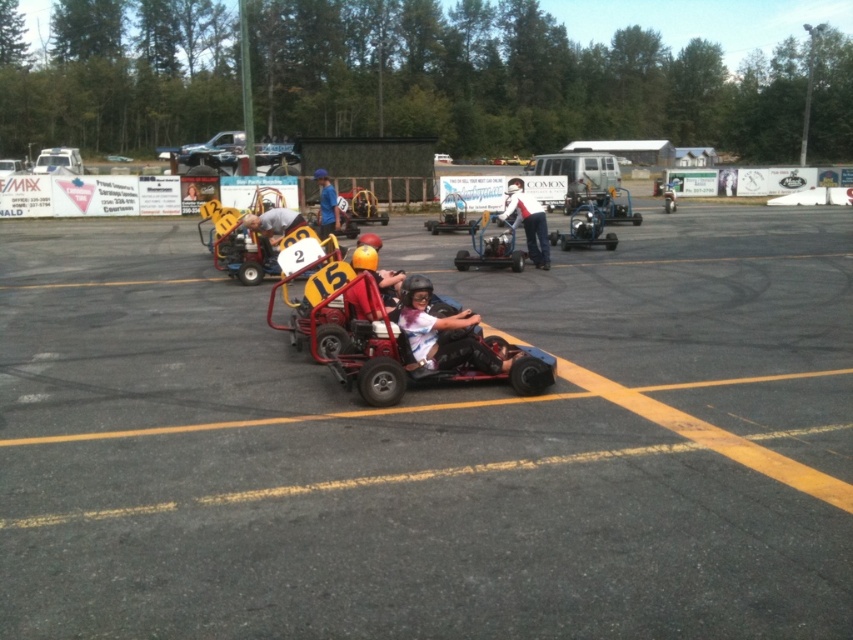
You are a race official at the go kart track. You need to determine the starting positions of the karts. According to the image, which point is closer to the starting line, point (321, 422) or point (369, 248)?

Point (321, 422) is in front of point (369, 248), so it is closer to the starting line.